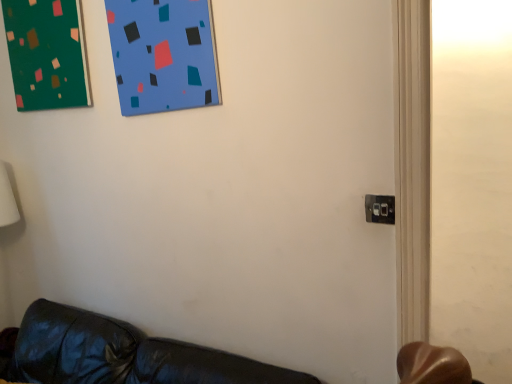
Describe the element at coordinates (380, 209) in the screenshot. I see `black plastic electric outlet at lower right` at that location.

This screenshot has width=512, height=384. I want to click on black plastic electric outlet at lower right, so click(x=380, y=209).

Measure the distance between point [70,57] and camera.

Point [70,57] and camera are 6.16 feet apart.

Find the location of a particular element. This screenshot has height=384, width=512. green matte board at upper left is located at coordinates (47, 53).

The width and height of the screenshot is (512, 384). Describe the element at coordinates (47, 53) in the screenshot. I see `green matte board at upper left` at that location.

The height and width of the screenshot is (384, 512). What are the coordinates of `black plastic electric outlet at lower right` in the screenshot? It's located at (380, 209).

Between black plastic electric outlet at lower right and green matte board at upper left, which one appears on the right side from the viewer's perspective?

black plastic electric outlet at lower right.

Which object is further away from the camera, black plastic electric outlet at lower right or green matte board at upper left?

Positioned behind is green matte board at upper left.

Considering the positions of points (382, 208) and (60, 27), is point (382, 208) farther from camera compared to point (60, 27)?

No, it is not.

From the image's perspective, does black plastic electric outlet at lower right appear lower than green matte board at upper left?

Yes, from the image's perspective, black plastic electric outlet at lower right is below green matte board at upper left.

From a real-world perspective, is black plastic electric outlet at lower right physically located above or below green matte board at upper left?

From a real-world perspective, black plastic electric outlet at lower right is physically below green matte board at upper left.

Considering the sizes of black plastic electric outlet at lower right and green matte board at upper left in the image, is black plastic electric outlet at lower right wider or thinner than green matte board at upper left?

In the image, black plastic electric outlet at lower right appears to be more narrow than green matte board at upper left.

Which of these two, black plastic electric outlet at lower right or green matte board at upper left, stands taller?

green matte board at upper left is taller.

Which of these two, black plastic electric outlet at lower right or green matte board at upper left, is bigger?

green matte board at upper left.

Which is correct: black plastic electric outlet at lower right is inside green matte board at upper left, or outside of it?

black plastic electric outlet at lower right lies outside green matte board at upper left.

Is black plastic electric outlet at lower right far away from green matte board at upper left?

Answer: black plastic electric outlet at lower right is positioned a significant distance from green matte board at upper left.

Looking at this image, is black plastic electric outlet at lower right facing towards green matte board at upper left?

No, black plastic electric outlet at lower right is not oriented towards green matte board at upper left.

Can you tell me how much black plastic electric outlet at lower right and green matte board at upper left differ in facing direction?

5.82 degrees.

You are a GUI agent. You are given a task and a screenshot of the screen. Output one action in this format:
    pyautogui.click(x=<x>, y=<y>)
    Task: Click on the electric outlet located underneath the green matte board at upper left (from a real-world perspective)
    The image size is (512, 384).
    Given the screenshot: What is the action you would take?
    pyautogui.click(x=380, y=209)

Does green matte board at upper left appear on the right side of black plastic electric outlet at lower right?

In fact, green matte board at upper left is to the left of black plastic electric outlet at lower right.

Is green matte board at upper left positioned behind black plastic electric outlet at lower right?

Yes, the depth of green matte board at upper left is greater than that of black plastic electric outlet at lower right.

Does point (20, 1) come closer to viewer compared to point (376, 213)?

No, it is behind (376, 213).

From the image's perspective, is green matte board at upper left under black plastic electric outlet at lower right?

Incorrect, from the image's perspective, green matte board at upper left is higher than black plastic electric outlet at lower right.

From a real-world perspective, between green matte board at upper left and black plastic electric outlet at lower right, who is vertically higher?

In real-world perspective, green matte board at upper left is above.

Considering the sizes of objects green matte board at upper left and black plastic electric outlet at lower right in the image provided, who is wider, green matte board at upper left or black plastic electric outlet at lower right?

green matte board at upper left is wider.

Considering the sizes of objects green matte board at upper left and black plastic electric outlet at lower right in the image provided, who is shorter, green matte board at upper left or black plastic electric outlet at lower right?

black plastic electric outlet at lower right.

Is green matte board at upper left bigger than black plastic electric outlet at lower right?

Yes.

Choose the correct answer: Is green matte board at upper left inside black plastic electric outlet at lower right or outside it?

The correct answer is: outside.

Can you see green matte board at upper left touching black plastic electric outlet at lower right?

They are not placed beside each other.

In the scene shown: Could you tell me if green matte board at upper left is turned towards black plastic electric outlet at lower right?

No, green matte board at upper left is not aimed at black plastic electric outlet at lower right.

Image resolution: width=512 pixels, height=384 pixels. I want to click on electric outlet located on the right of green matte board at upper left, so (380, 209).

Locate an element on the screen. electric outlet below the green matte board at upper left (from the image's perspective) is located at coordinates (380, 209).

Locate an element on the screen. electric outlet located in front of the green matte board at upper left is located at coordinates (380, 209).